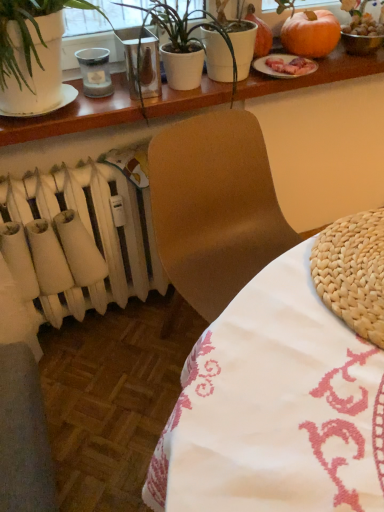
Question: Is white woven placemat at lower left, which ranks as the 1th table in bottom-to-top order, closer to camera compared to white matte pot at upper center?

Choices:
 (A) no
 (B) yes

Answer: (B)

Question: Can you confirm if white woven placemat at lower left, arranged as the second table when viewed from the top, is positioned to the left of white matte pot at upper center?

Choices:
 (A) yes
 (B) no

Answer: (B)

Question: Is white woven placemat at lower left, which ranks as the 1th table in bottom-to-top order, smaller than white matte pot at upper center?

Choices:
 (A) yes
 (B) no

Answer: (B)

Question: Can you confirm if white woven placemat at lower left, arranged as the second table when viewed from the top, is taller than white matte pot at upper center?

Choices:
 (A) no
 (B) yes

Answer: (B)

Question: Is white woven placemat at lower left, arranged as the second table when viewed from the top, thinner than white matte pot at upper center?

Choices:
 (A) no
 (B) yes

Answer: (A)

Question: From a real-world perspective, is white woven placemat at lower left, arranged as the second table when viewed from the top, physically above white matte pot at upper center?

Choices:
 (A) no
 (B) yes

Answer: (A)

Question: Is white woven placemat at lower left, arranged as the second table when viewed from the top, smaller than white matte radiator at lower left?

Choices:
 (A) yes
 (B) no

Answer: (B)

Question: From the image's perspective, does white woven placemat at lower left, arranged as the second table when viewed from the top, appear lower than white matte radiator at lower left?

Choices:
 (A) no
 (B) yes

Answer: (B)

Question: From a real-world perspective, is white woven placemat at lower left, which ranks as the 1th table in bottom-to-top order, under white matte radiator at lower left?

Choices:
 (A) no
 (B) yes

Answer: (A)

Question: Can white matte radiator at lower left be found inside white woven placemat at lower left, arranged as the second table when viewed from the top?

Choices:
 (A) no
 (B) yes

Answer: (A)

Question: Is white woven placemat at lower left, which ranks as the 1th table in bottom-to-top order, bigger than white matte radiator at lower left?

Choices:
 (A) yes
 (B) no

Answer: (A)

Question: Is white woven placemat at lower left, which ranks as the 1th table in bottom-to-top order, thinner than white matte radiator at lower left?

Choices:
 (A) yes
 (B) no

Answer: (B)

Question: Is white matte radiator at lower left oriented away from white woven placemat at lower left, arranged as the second table when viewed from the top?

Choices:
 (A) no
 (B) yes

Answer: (A)